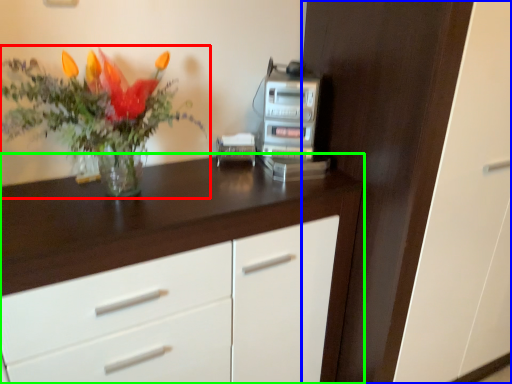
Question: Which object is positioned closest to houseplant (highlighted by a red box)? Select from dresser (highlighted by a blue box) and chest of drawers (highlighted by a green box).

Choices:
 (A) dresser
 (B) chest of drawers

Answer: (B)